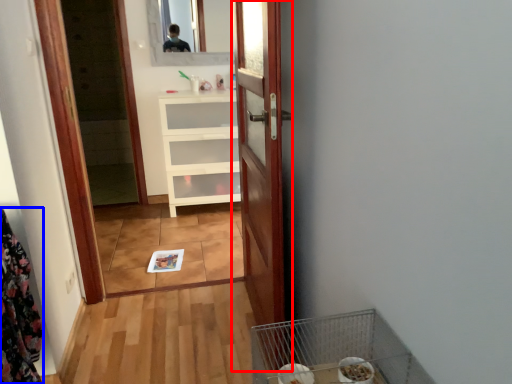
Question: Among these objects, which one is nearest to the camera, door (highlighted by a red box) or laundry (highlighted by a blue box)?

Choices:
 (A) door
 (B) laundry

Answer: (B)